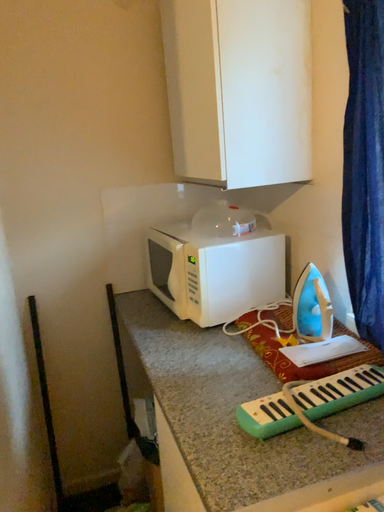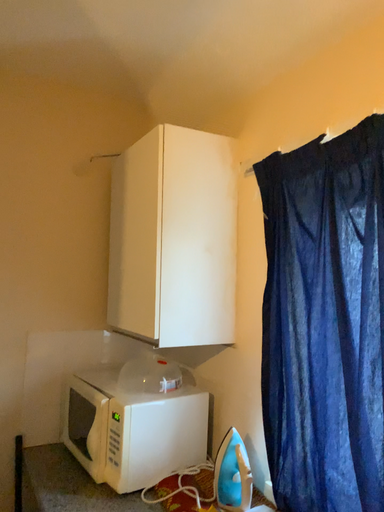
Question: How did the camera likely rotate when shooting the video?

Choices:
 (A) rotated left
 (B) rotated right

Answer: (B)